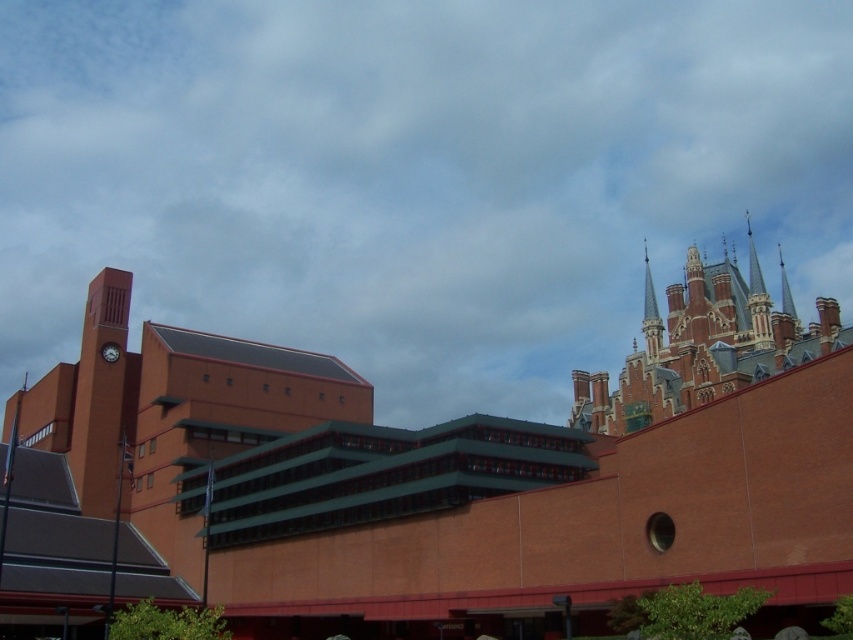
In the scene shown: Measure the distance between point (111, 406) and camera.

The distance of point (111, 406) from camera is 80.48 meters.

Is matte orange clock tower at left to the right of matte gray clock at upper left from the viewer's perspective?

Incorrect, matte orange clock tower at left is not on the right side of matte gray clock at upper left.

Describe the element at coordinates (100, 396) in the screenshot. I see `matte orange clock tower at left` at that location.

Locate an element on the screen. This screenshot has width=853, height=640. matte orange clock tower at left is located at coordinates (100, 396).

Is point (657, 307) more distant than point (108, 353)?

Yes.

Who is shorter, smooth stone spire at upper right or matte gray clock at upper left?

With less height is matte gray clock at upper left.

Is point (656, 333) closer to viewer compared to point (103, 353)?

No, it is not.

Find the location of `smooth stone spire at upper right`. smooth stone spire at upper right is located at coordinates (650, 314).

In the scene shown: Does matte orange clock tower at left have a greater height compared to smooth stone spire at upper right?

No, matte orange clock tower at left is not taller than smooth stone spire at upper right.

Between matte orange clock tower at left and smooth stone spire at upper right, which one is positioned higher?

smooth stone spire at upper right is higher up.

Is point (131, 376) closer to viewer compared to point (653, 342)?

Yes.

I want to click on matte orange clock tower at left, so click(100, 396).